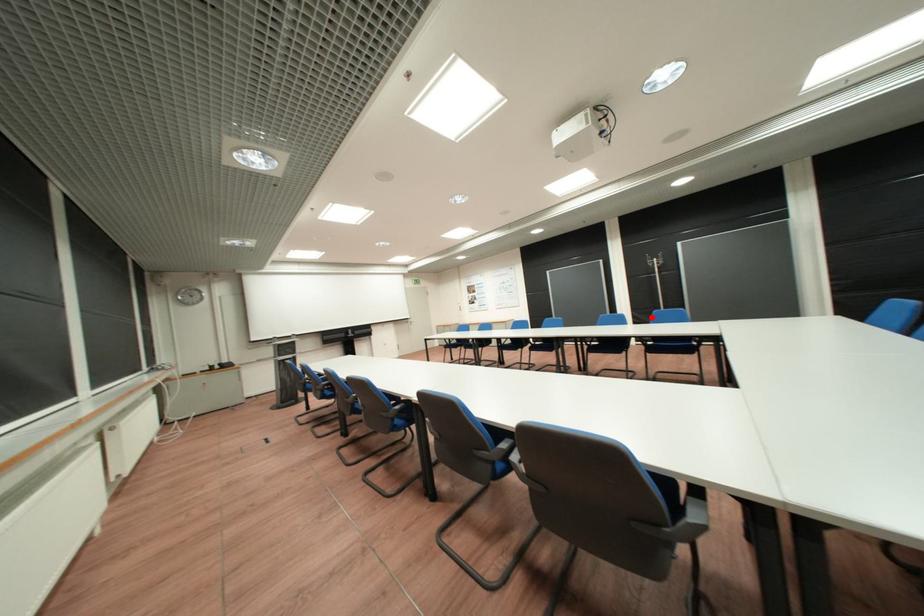
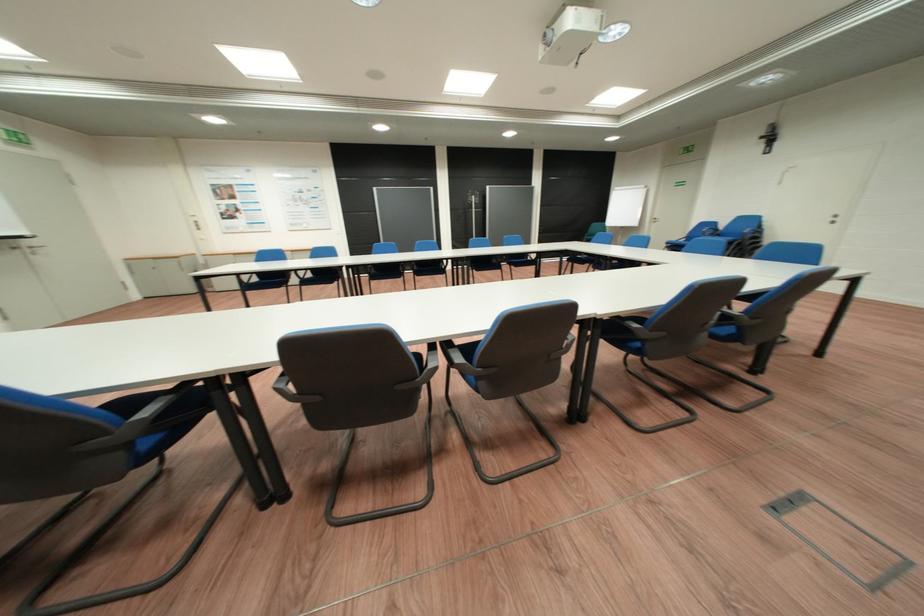
Question: I am providing you with two images of the same scene from different viewpoints. Image1 has a red point marked. In image2, the corresponding 3D location appears at what relative position? Reply with the corresponding letter.

Choices:
 (A) Closer
 (B) Farther

Answer: (A)